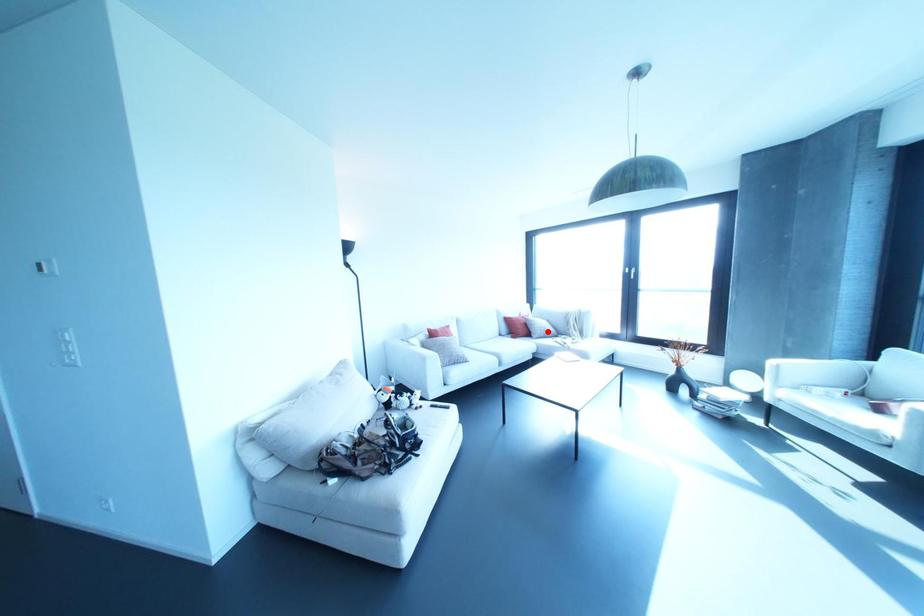
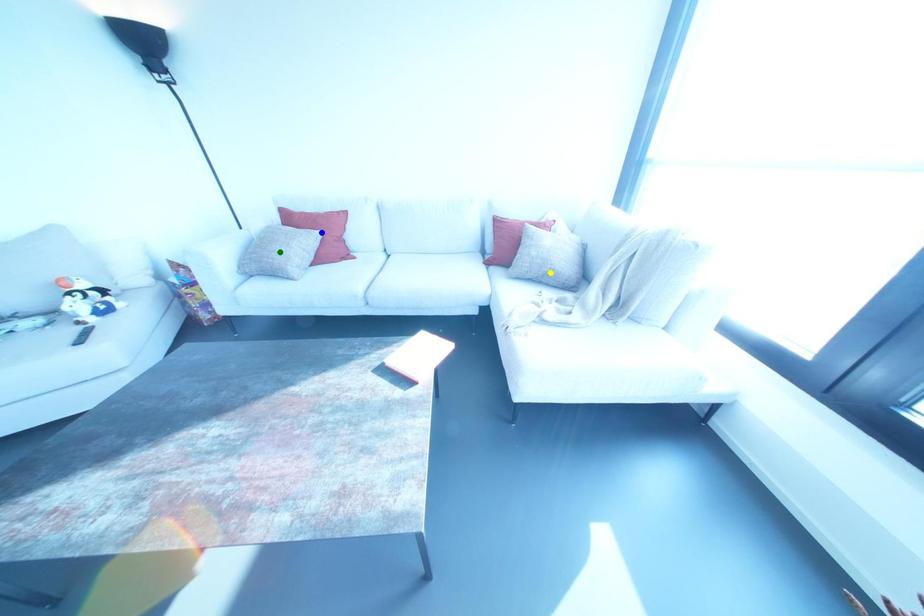
Question: I am providing you with two images of the same scene from different viewpoints. A red point is marked on the first image. You are given multiple points on the second image. Can you choose the point in image 2 that corresponds to the point in image 1?

Choices:
 (A) green point
 (B) yellow point
 (C) blue point

Answer: (B)